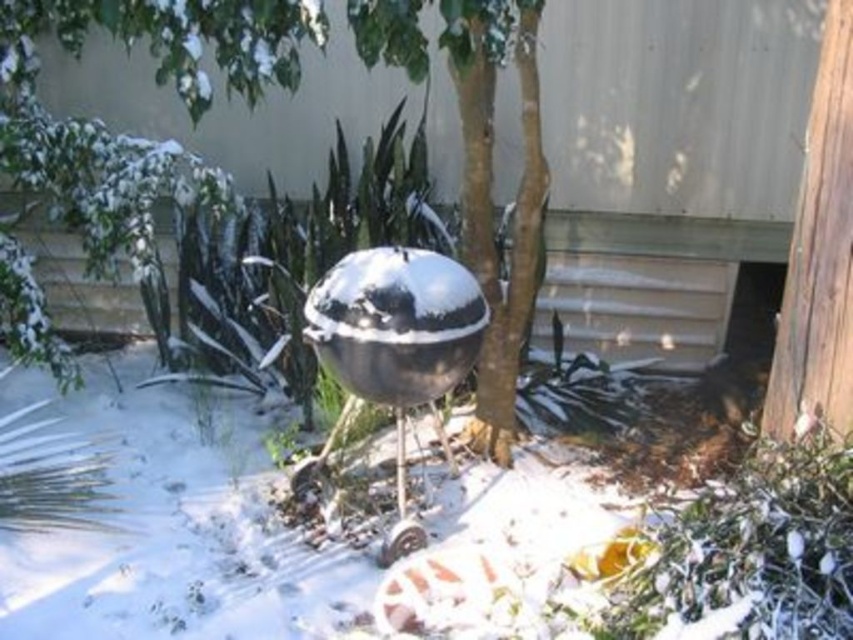
You are a gardener trying to water the green leafy tree at center and the shiny metallic sphere at center. Which object should you water first if you want to avoid getting the sphere wet?

You should water the green leafy tree at center first because it is in front of the shiny metallic sphere at center, so watering the tree first would prevent water from reaching the sphere afterward.

You are planning to place a new decorative statue in the backyard. The statue requires a clear space of 1 meter in diameter. Considering the green leafy tree at center, can you place the statue near it without being too close?

The green leafy tree at center is located at point (490, 195). Since the statue requires a clear space of 1 meter in diameter, you need to ensure the statue is placed at least 0.5 meters away from the tree to avoid encroaching on the required space. Check the surrounding area for sufficient clearance around the tree.